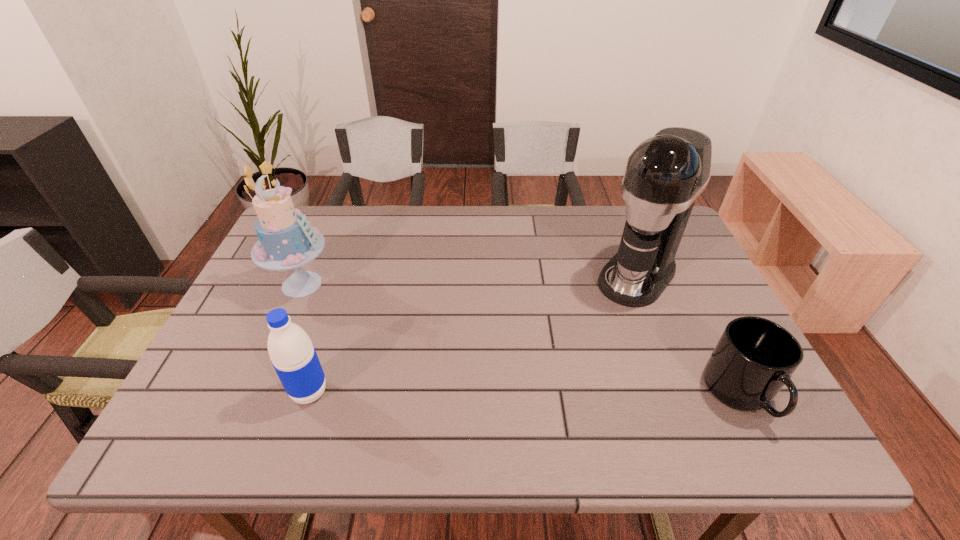
The height and width of the screenshot is (540, 960). Identify the location of the third tallest object. (294, 358).

Identify the location of the shortest object. This screenshot has width=960, height=540. (754, 358).

You are a GUI agent. You are given a task and a screenshot of the screen. Output one action in this format:
    pyautogui.click(x=<x>, y=<y>)
    Task: Click on the coffee maker
    Image resolution: width=960 pixels, height=540 pixels.
    Given the screenshot: What is the action you would take?
    pyautogui.click(x=665, y=174)

At what (x,y) coordinates should I click in order to perform the action: click on cake. Please return your answer as a coordinate pair (x, y). This screenshot has width=960, height=540. Looking at the image, I should click on (286, 241).

Where is `vacant region located 0.050m on the left of the water bottle`? The height and width of the screenshot is (540, 960). vacant region located 0.050m on the left of the water bottle is located at coordinates (268, 392).

Where is `free region located 0.050m place cup under the spout of the coffee maker`? The height and width of the screenshot is (540, 960). free region located 0.050m place cup under the spout of the coffee maker is located at coordinates (610, 310).

The height and width of the screenshot is (540, 960). In order to click on free space located 0.330m place cup under the spout of the coffee maker in this screenshot , I will do `click(549, 381)`.

At what (x,y) coordinates should I click in order to perform the action: click on vacant space located 0.050m place cup under the spout of the coffee maker. Please return your answer as a coordinate pair (x, y). Image resolution: width=960 pixels, height=540 pixels. Looking at the image, I should click on [x=610, y=310].

This screenshot has width=960, height=540. Identify the location of vacant point located with a ladder on the side of the third shortest object. (389, 334).

Image resolution: width=960 pixels, height=540 pixels. What are the coordinates of `vacant area situated 0.150m with a ladder on the side of the third shortest object` in the screenshot? It's located at (366, 320).